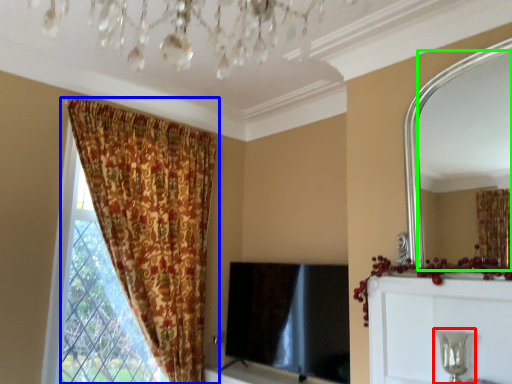
Question: Which is farther away from candle holder (highlighted by a red box)? curtain (highlighted by a blue box) or mirror (highlighted by a green box)?

Choices:
 (A) curtain
 (B) mirror

Answer: (B)